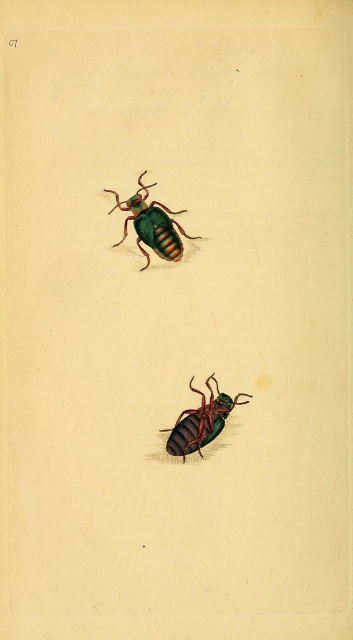
Question: Does green glossy beetle at center appear under green matte beetle at lower center?

Choices:
 (A) no
 (B) yes

Answer: (A)

Question: Which object appears closest to the camera in this image?

Choices:
 (A) green matte beetle at lower center
 (B) green glossy beetle at center

Answer: (B)

Question: In this image, where is green glossy beetle at center located relative to green matte beetle at lower center?

Choices:
 (A) left
 (B) right

Answer: (A)

Question: Is green glossy beetle at center above green matte beetle at lower center?

Choices:
 (A) yes
 (B) no

Answer: (A)